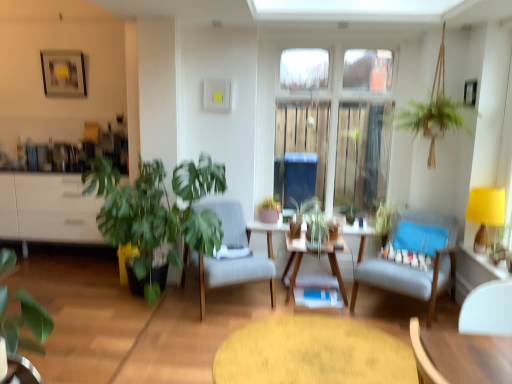
Question: Is green matte plant at lower left, which ranks as the first houseplant in front-to-back order, oriented away from green leafy plant at left, marked as the 2th houseplant in a left-to-right arrangement?

Choices:
 (A) yes
 (B) no

Answer: (B)

Question: Considering the relative sizes of green matte plant at lower left, positioned as the 3th houseplant in back-to-front order, and green leafy plant at left, marked as the 2th houseplant in a left-to-right arrangement, in the image provided, is green matte plant at lower left, positioned as the 3th houseplant in back-to-front order, shorter than green leafy plant at left, marked as the 2th houseplant in a left-to-right arrangement,?

Choices:
 (A) yes
 (B) no

Answer: (A)

Question: Is green matte plant at lower left, the third houseplant positioned from the right, far away from green leafy plant at left, marked as the 2th houseplant in a left-to-right arrangement?

Choices:
 (A) no
 (B) yes

Answer: (B)

Question: From the image's perspective, would you say green matte plant at lower left, which ranks as the first houseplant in front-to-back order, is shown under green leafy plant at left, marked as the 2th houseplant in a left-to-right arrangement?

Choices:
 (A) no
 (B) yes

Answer: (B)

Question: Is green matte plant at lower left, which ranks as the first houseplant in front-to-back order, outside green leafy plant at left, the 2th houseplant in the back-to-front sequence?

Choices:
 (A) no
 (B) yes

Answer: (B)

Question: In terms of width, does white glossy cabinet at left look wider or thinner when compared to wooden table at right, positioned as the first table in right-to-left order?

Choices:
 (A) wide
 (B) thin

Answer: (A)

Question: In the image, is white glossy cabinet at left positioned in front of or behind wooden table at right, which is counted as the second table, starting from the left?

Choices:
 (A) front
 (B) behind

Answer: (B)

Question: Is point (25, 226) closer or farther from the camera than point (492, 264)?

Choices:
 (A) farther
 (B) closer

Answer: (A)

Question: Is white glossy cabinet at left bigger or smaller than wooden table at right, positioned as the first table in right-to-left order?

Choices:
 (A) big
 (B) small

Answer: (A)

Question: From a real-world perspective, is wooden round table at center physically located above or below clear glass window at center?

Choices:
 (A) above
 (B) below

Answer: (B)

Question: Considering the positions of wooden round table at center and clear glass window at center in the image, is wooden round table at center bigger or smaller than clear glass window at center?

Choices:
 (A) big
 (B) small

Answer: (B)

Question: Would you say wooden round table at center is to the left or to the right of clear glass window at center in the picture?

Choices:
 (A) right
 (B) left

Answer: (B)

Question: In the image, is wooden round table at center positioned in front of or behind clear glass window at center?

Choices:
 (A) front
 (B) behind

Answer: (A)

Question: In the image, is green matte plant at lower left, the third houseplant positioned from the right, on the left side or the right side of matte pink pot at center, the third houseplant positioned from the left?

Choices:
 (A) left
 (B) right

Answer: (A)

Question: Choose the correct answer: Is green matte plant at lower left, which ranks as the first houseplant in front-to-back order, inside matte pink pot at center, acting as the 3th houseplant starting from the front, or outside it?

Choices:
 (A) inside
 (B) outside

Answer: (B)